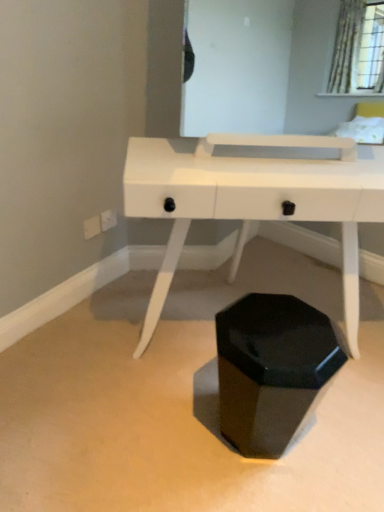
This screenshot has width=384, height=512. Identify the location of vacant area located to the right-hand side of black glossy hexagonal at center. (338, 435).